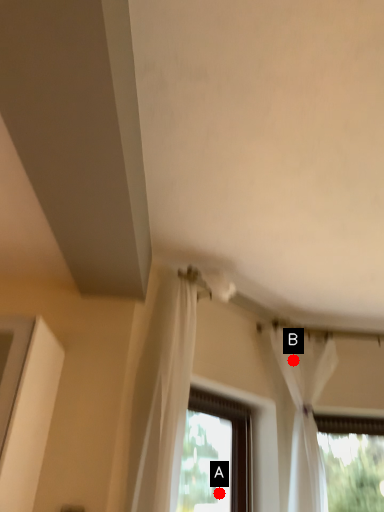
Question: Two points are circled on the image, labeled by A and B beside each circle. Which of the following is the closest to the observer?

Choices:
 (A) A is closer
 (B) B is closer

Answer: (B)